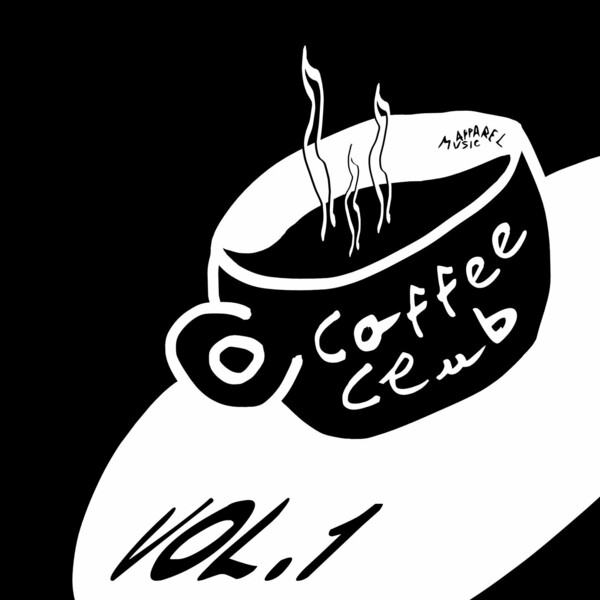
At what (x,y) coordinates should I click in order to perform the action: click on text on mug. Please return your answer as a coordinate pair (x, y). The height and width of the screenshot is (600, 600). Looking at the image, I should click on (423, 312).